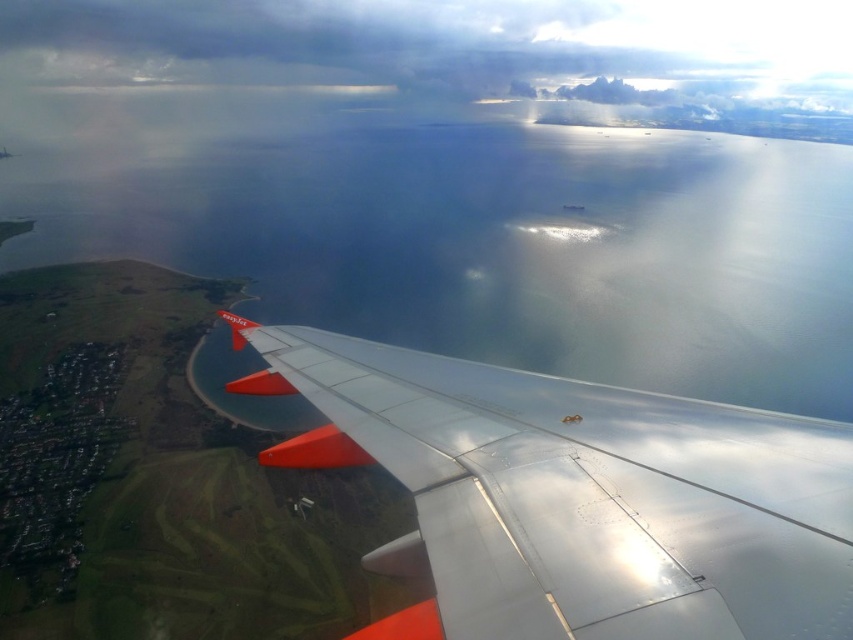
Can you confirm if metallic silver wing at lower right is positioned to the right of metallic silver wing at lower center?

Indeed, metallic silver wing at lower right is positioned on the right side of metallic silver wing at lower center.

Is metallic silver wing at lower right closer to the viewer compared to metallic silver wing at lower center?

Yes, metallic silver wing at lower right is closer to the viewer.

Who is more distant from viewer, (431, 451) or (310, 500)?

Positioned behind is point (310, 500).

I want to click on metallic silver wing at lower right, so click(x=577, y=497).